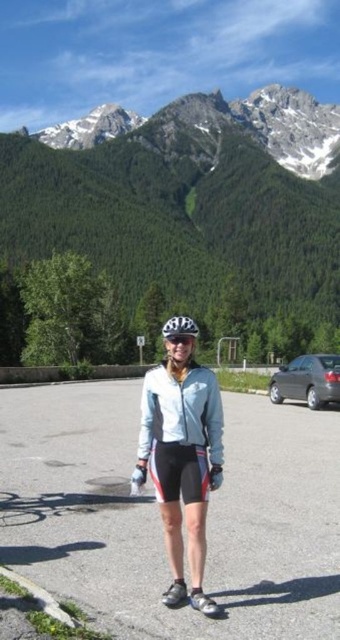
Question: Which point is farther to the camera?

Choices:
 (A) (175, 406)
 (B) (187, 292)
 (C) (300, 486)
 (D) (312, 364)

Answer: (B)

Question: Which is farther from the matte black helmet at center?

Choices:
 (A) clear plastic goggles at center
 (B) matte white shorts at center

Answer: (A)

Question: Observing the image, what is the correct spatial positioning of green forested mountain at upper center in reference to satin silver sedan at right?

Choices:
 (A) below
 (B) above

Answer: (B)

Question: Is matte white shorts at center closer to the viewer compared to clear plastic goggles at center?

Choices:
 (A) no
 (B) yes

Answer: (B)

Question: Among these points, which one is farthest from the camera?

Choices:
 (A) (194, 326)
 (B) (331, 392)
 (C) (267, 86)

Answer: (C)

Question: In this image, where is light blue fabric jacket at center located relative to matte black helmet at center?

Choices:
 (A) right
 (B) left

Answer: (B)